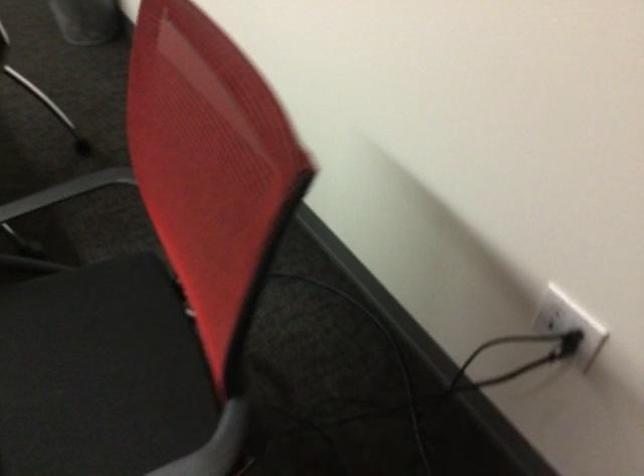
This screenshot has height=476, width=644. I want to click on chair armrest, so click(221, 443).